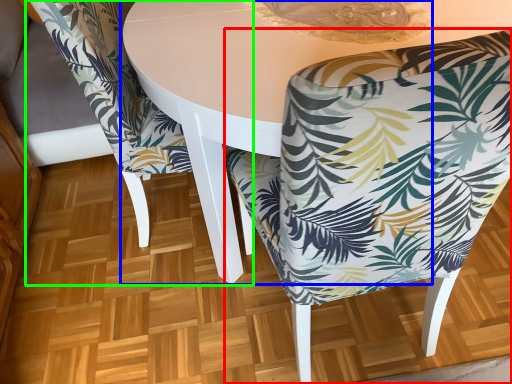
Question: Considering the real-world distances, which object is farthest from chair (highlighted by a red box)? round table (highlighted by a blue box) or chair (highlighted by a green box)?

Choices:
 (A) round table
 (B) chair

Answer: (B)